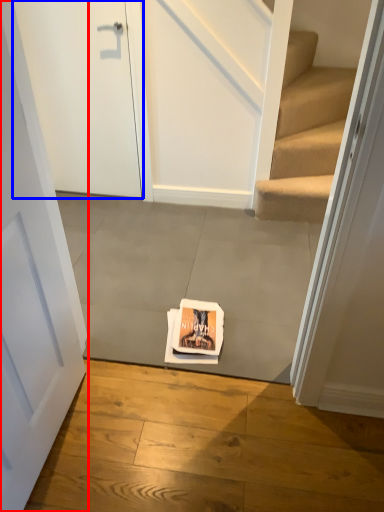
Question: Among these objects, which one is farthest to the camera, door (highlighted by a red box) or door (highlighted by a blue box)?

Choices:
 (A) door
 (B) door

Answer: (B)